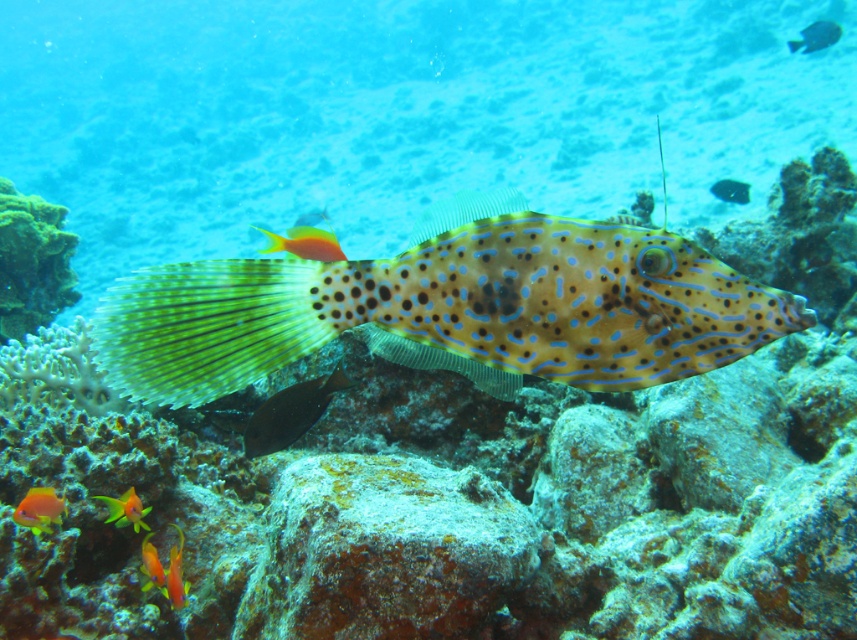
Between point (42, 502) and point (123, 502), which one is positioned in front?

Point (42, 502) is in front.

Which is behind, point (46, 493) or point (115, 506)?

The point (115, 506) is behind.

What do you see at coordinates (39, 509) in the screenshot? The image size is (857, 640). I see `orange-yellow coral at lower left` at bounding box center [39, 509].

This screenshot has width=857, height=640. Find the location of `orange-yellow coral at lower left`. orange-yellow coral at lower left is located at coordinates (39, 509).

Is translucent blue water at center bigger than shiny dark blue fish at center?

Correct, translucent blue water at center is larger in size than shiny dark blue fish at center.

Which is in front, point (476, 51) or point (270, 438)?

Point (270, 438) is in front.

Where is `translucent blue water at center`? Image resolution: width=857 pixels, height=640 pixels. translucent blue water at center is located at coordinates (397, 113).

Is point (31, 509) less distant than point (180, 596)?

Yes, it is.

Between orange-yellow coral at lower left and orange glossy fish at lower left, which one is positioned lower?

Positioned lower is orange glossy fish at lower left.

Does point (39, 490) lie behind point (184, 600)?

No, it is not.

Image resolution: width=857 pixels, height=640 pixels. In order to click on orange-yellow coral at lower left in this screenshot , I will do `click(39, 509)`.